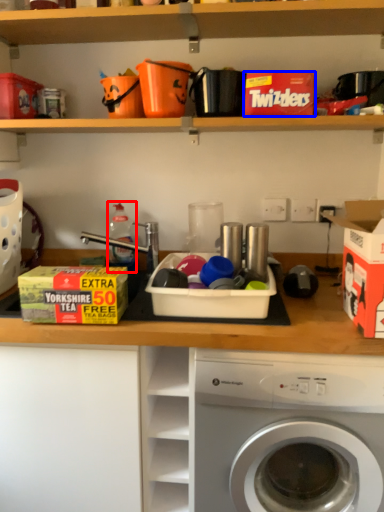
Question: Which object appears farthest to the camera in this image, bottle (highlighted by a red box) or storage box (highlighted by a blue box)?

Choices:
 (A) bottle
 (B) storage box

Answer: (A)